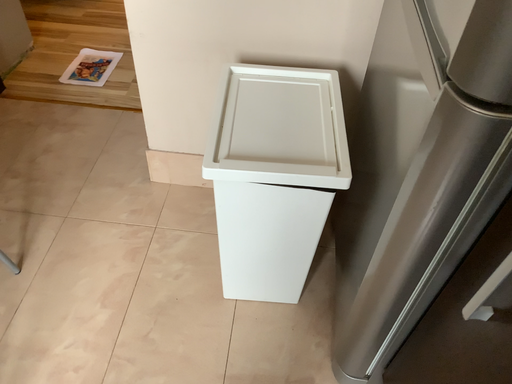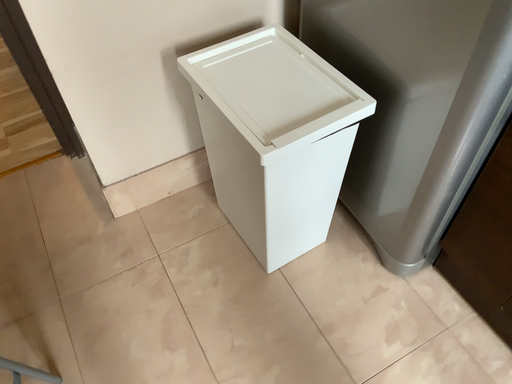
Question: How did the camera likely rotate when shooting the video?

Choices:
 (A) rotated left
 (B) rotated right

Answer: (B)